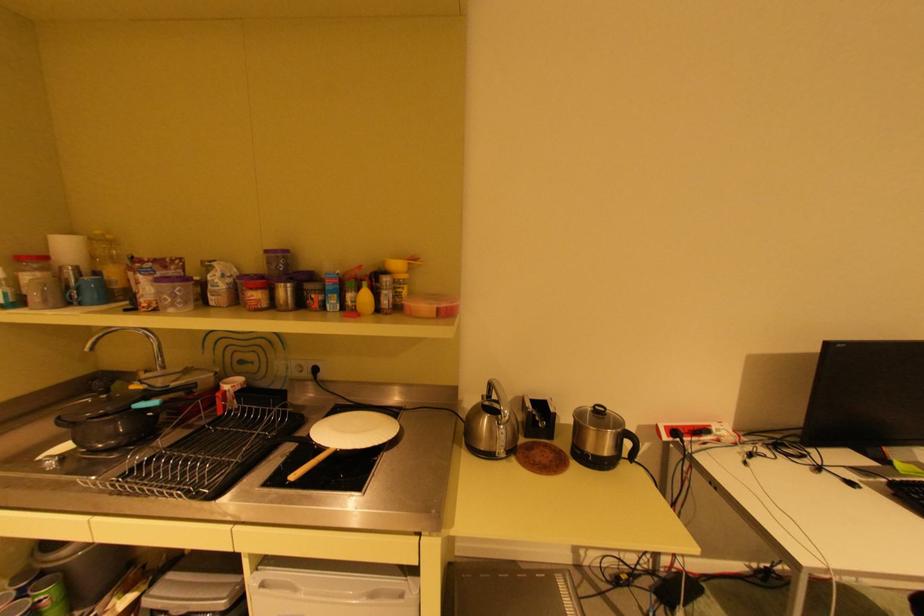
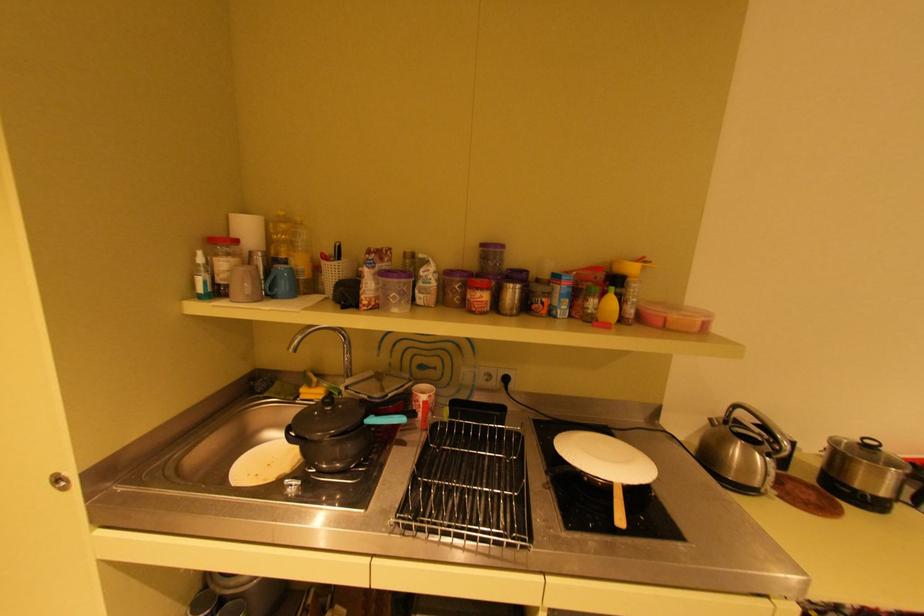
Question: The images are taken continuously from a first-person perspective. In which direction are you moving?

Choices:
 (A) Left
 (B) Right
 (C) Forward
 (D) Backward

Answer: (A)